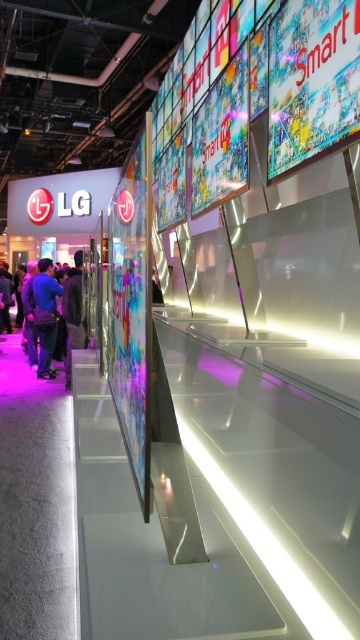
Is blue fabric shirt at left below dark gray jacket at left?

Actually, blue fabric shirt at left is above dark gray jacket at left.

Is point (47, 312) positioned after point (74, 257)?

That is False.

Is point (24, 301) farther from camera compared to point (78, 326)?

That is True.

Find the location of a particular element. blue fabric shirt at left is located at coordinates (42, 312).

Is dark blue shirt at center positioned behind dark gray jacket at left?

Yes, dark blue shirt at center is further from the viewer.

This screenshot has height=640, width=360. What do you see at coordinates (54, 308) in the screenshot? I see `dark blue shirt at center` at bounding box center [54, 308].

Find the location of `dark blue shirt at center`. dark blue shirt at center is located at coordinates pyautogui.click(x=54, y=308).

Is dark blue shirt at center smaller than blue fabric shirt at left?

Actually, dark blue shirt at center might be larger than blue fabric shirt at left.

Is point (75, 333) closer to viewer compared to point (37, 314)?

Yes, point (75, 333) is closer to viewer.

Is point (62, 317) closer to viewer compared to point (32, 291)?

Yes.

Where is `dark blue shirt at center`? The height and width of the screenshot is (640, 360). dark blue shirt at center is located at coordinates (54, 308).